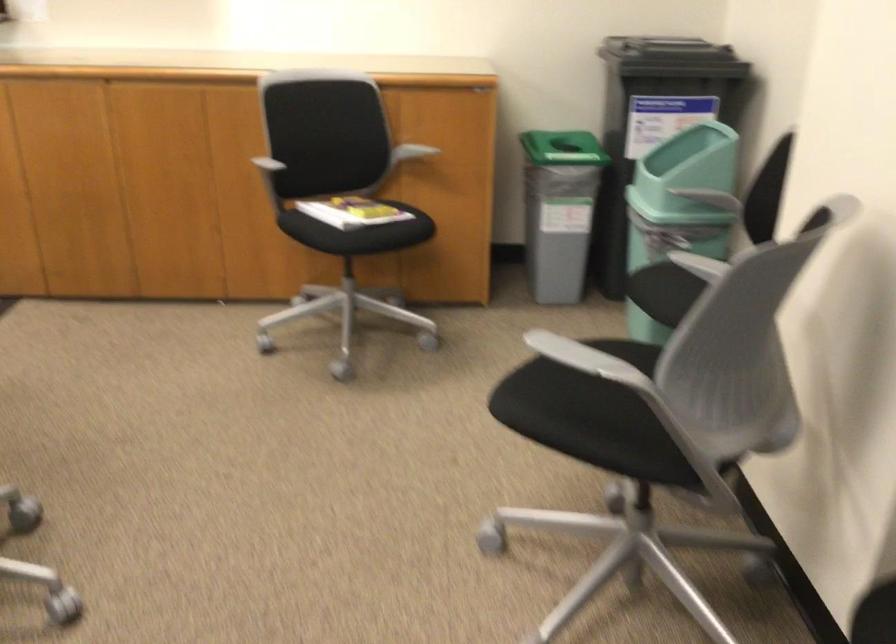
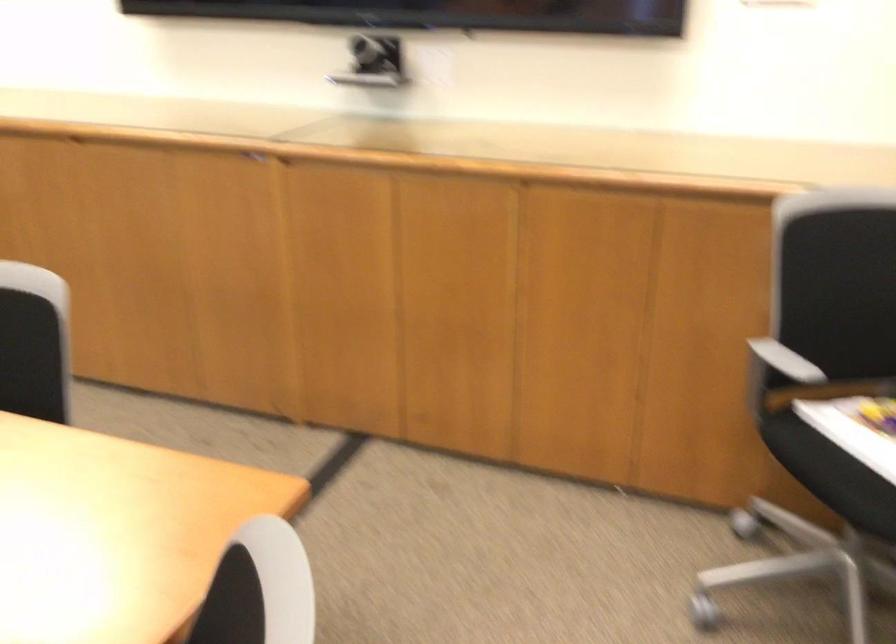
In the second image, find the point that corresponds to point (328, 207) in the first image.

(857, 428)